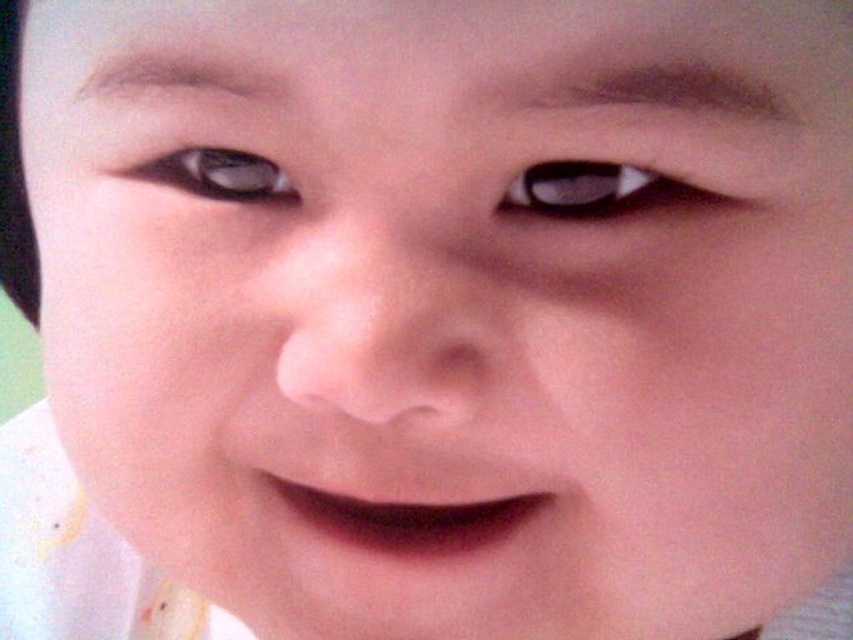
You are an artist trying to draw the person in the image. You need to decide which eye to start with based on their size. Which eye should you draw first, the matte black eye at upper center or the matte brown eye at upper left?

The matte black eye at upper center is larger in width than the matte brown eye at upper left, so you should draw the matte black eye at upper center first.

You are an AI analyzing facial features. You see a point at coordinates point (598, 189). Based on the scene description, what object does this point most likely correspond to?

The point corresponds to the matte black eye at upper center.

You are an artist trying to replicate this portrait. You need to place the matte black eye at upper center precisely. According to the coordinates provided, where should you position it on a canvas that uses a normalized coordinate system from 0 to 1 in both x and y axes?

The matte black eye at upper center should be positioned at the coordinates point (598,189) on the canvas.